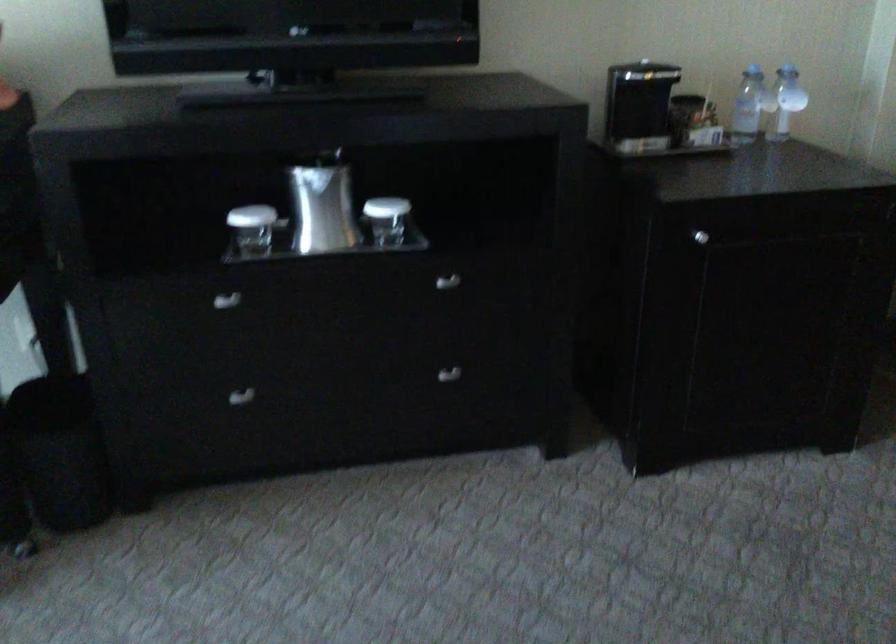
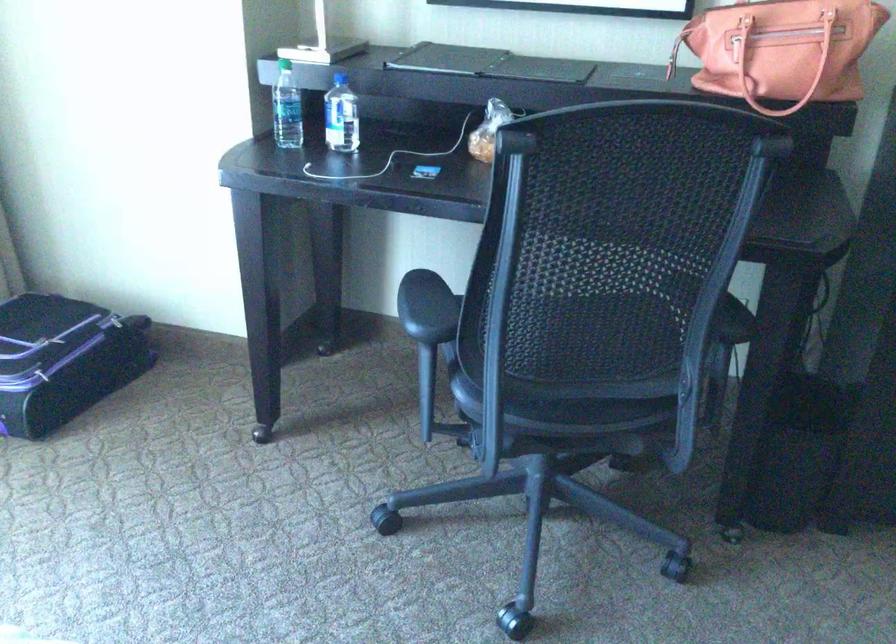
Question: The camera is either moving clockwise (left) or counter-clockwise (right) around the object. The first image is from the beginning of the video and the second image is from the end. Is the camera moving left or right when shooting the video?

Choices:
 (A) Left
 (B) Right

Answer: (B)